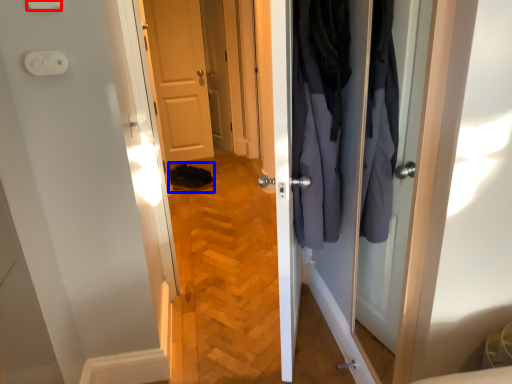
Question: Which point is closer to the camera, light switch (highlighted by a red box) or shoe (highlighted by a blue box)?

Choices:
 (A) light switch
 (B) shoe

Answer: (A)